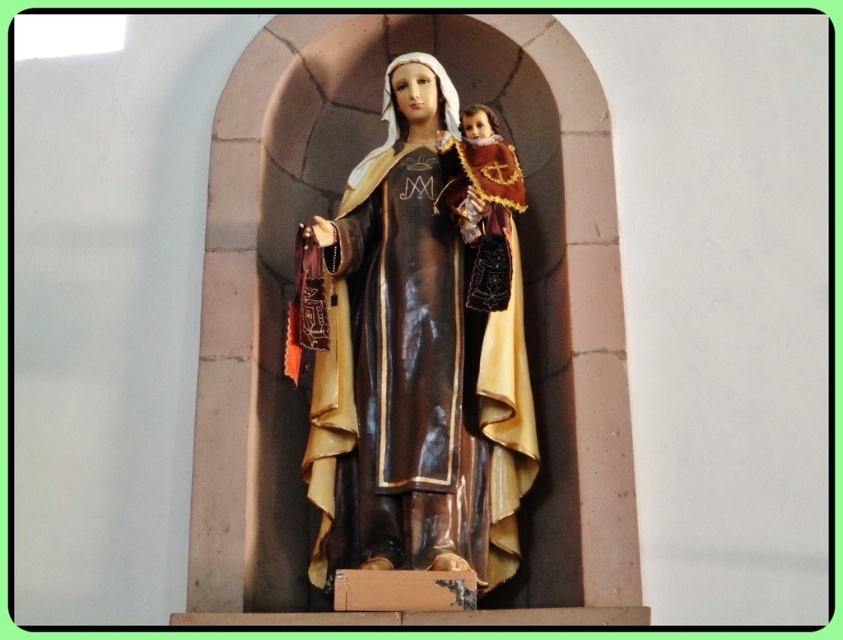
You are a painter who needs to place a 1.2 meter wide canvas between the matte brown statue at center and the wooden doll at center. Can the canvas fit between them?

The matte brown statue at center might be wider than wooden doll at center, so the total width between them could vary. If the statue is indeed wider, the space between them might accommodate the 1.2 meter canvas. However, without exact measurements, it is uncertain.

You are an art conservator examining the statue of Mary and the child in the arched niche. You notice the matte brown statue at center and the wooden doll at center. Which object is placed above the other?

The wooden doll at center is placed above the matte brown statue at center because the statue is positioned under the wooden doll.